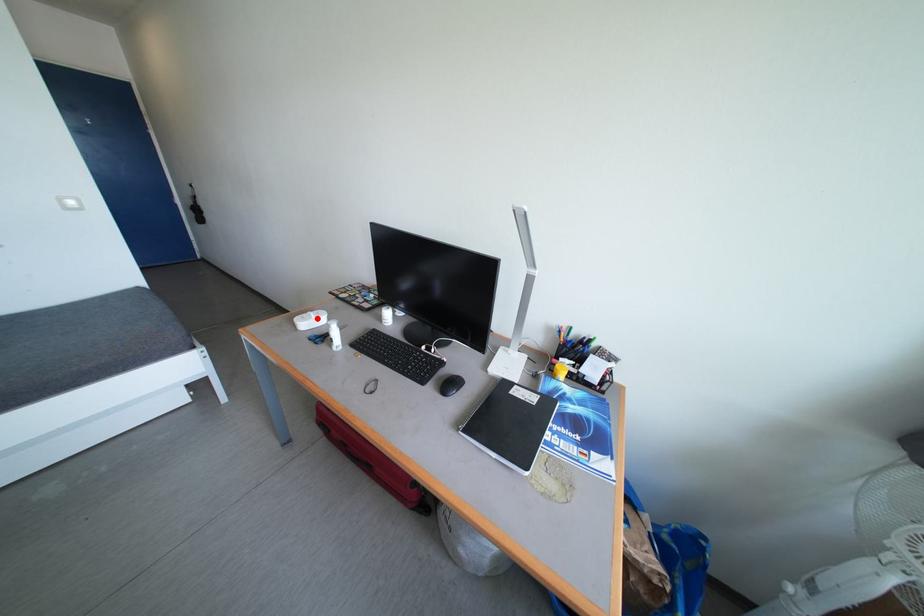
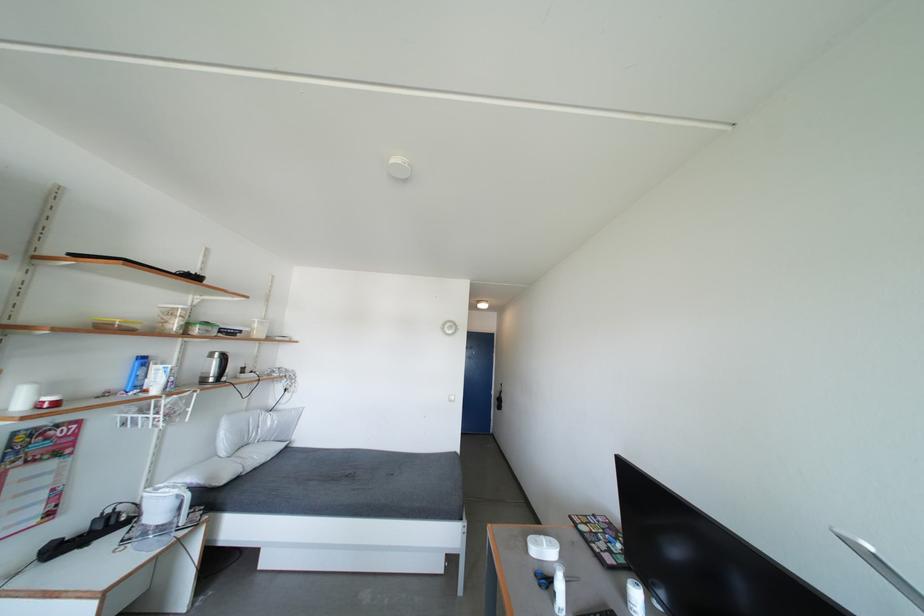
Question: I am providing you with two images of the same scene from different viewpoints. A red point is marked on the first image. At the location where the point appears in image 1, is it still visible in image 2?

Choices:
 (A) Yes
 (B) No

Answer: (A)